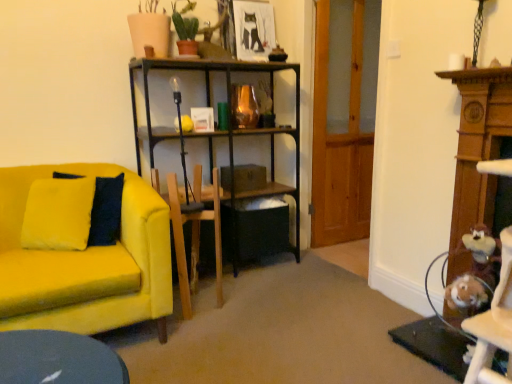
The height and width of the screenshot is (384, 512). In order to click on vacant space underneath wooden swivel chair at center (from a real-world perspective) in this screenshot , I will do `click(197, 300)`.